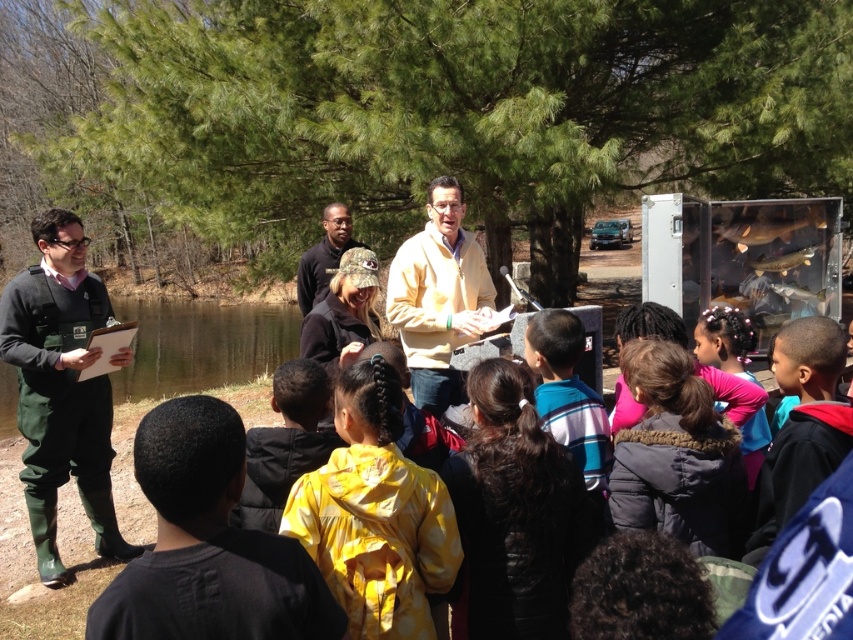
Question: Which is farther from the dark brown fur coat at center?

Choices:
 (A) green matte water at left
 (B) yellow matte jacket at center
 (C) yellow polka dot jacket at center
 (D) camouflage fabric cap at center

Answer: (A)

Question: Does striped cotton shirt at center have a greater width compared to camouflage fabric cap at center?

Choices:
 (A) yes
 (B) no

Answer: (B)

Question: Among these objects, which one is nearest to the camera?

Choices:
 (A) yellow polka dot jacket at center
 (B) green matte water at left

Answer: (A)

Question: Is striped cotton shirt at center bigger than camouflage fabric cap at center?

Choices:
 (A) yes
 (B) no

Answer: (B)

Question: Estimate the real-world distances between objects in this image. Which object is closer to the green matte water at left?

Choices:
 (A) yellow matte jacket at center
 (B) dark brown fur coat at center
 (C) green uniform at left
 (D) yellow polka dot jacket at center

Answer: (D)

Question: Is green uniform at left wider than yellow matte jacket at center?

Choices:
 (A) yes
 (B) no

Answer: (A)